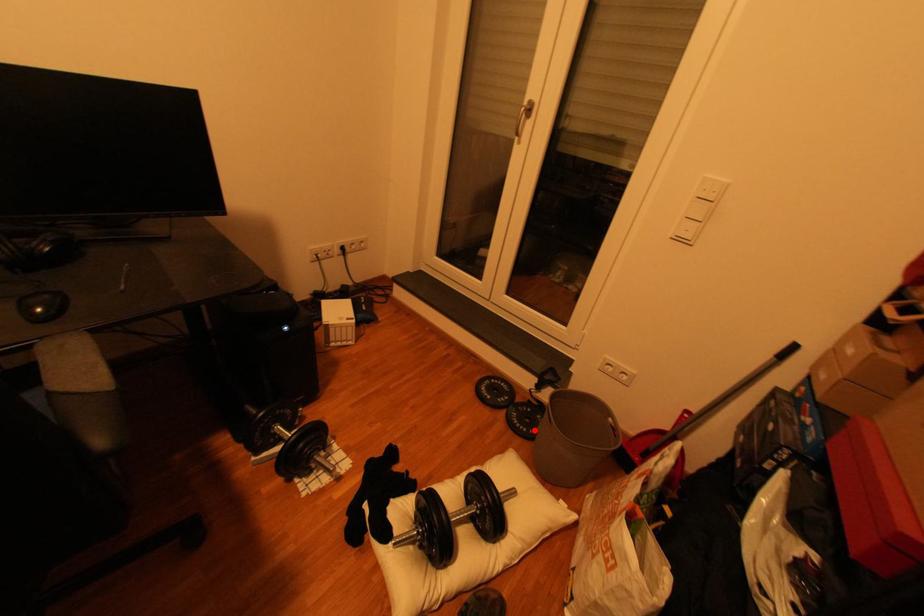
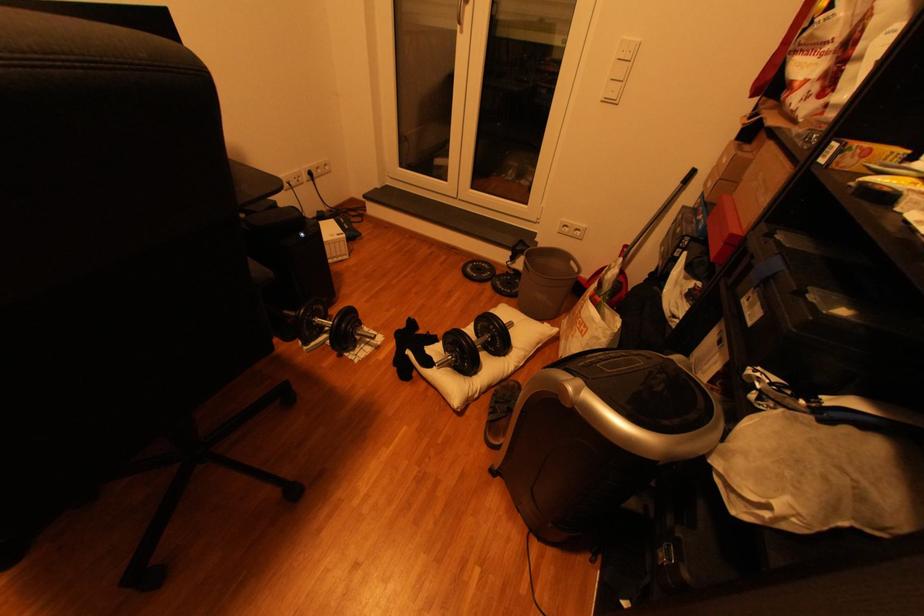
Question: A red point is marked in image1. In image2, is the corresponding 3D point closer to the camera or farther? Reply with the corresponding letter.

Choices:
 (A) The corresponding 3D point is closer.
 (B) The corresponding 3D point is farther.

Answer: (A)